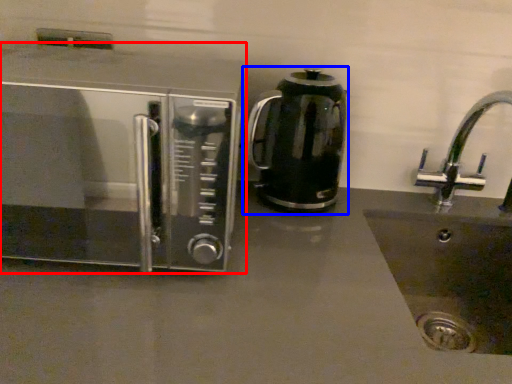
Question: Among these objects, which one is nearest to the camera, microwave oven (highlighted by a red box) or kitchen appliance (highlighted by a blue box)?

Choices:
 (A) microwave oven
 (B) kitchen appliance

Answer: (A)